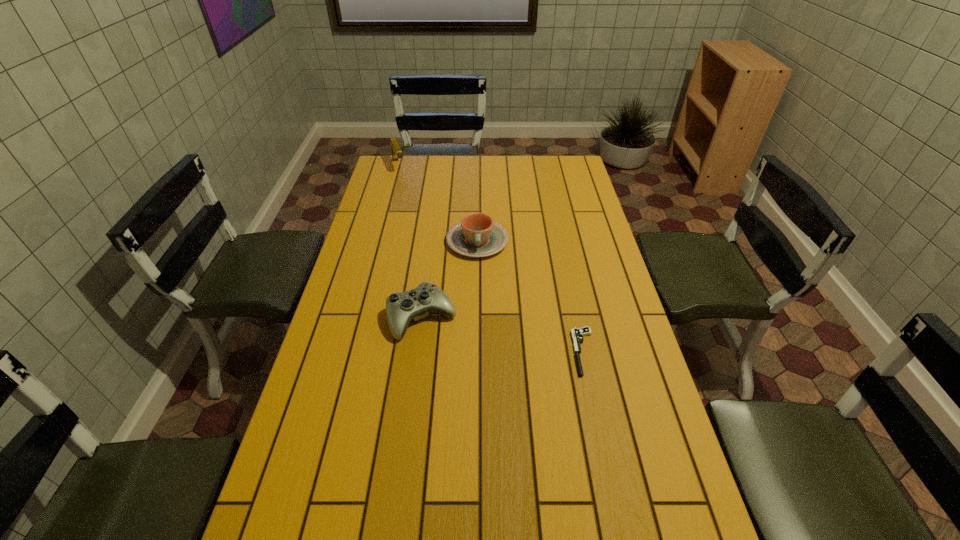
At what (x,y) coordinates should I click in order to perform the action: click on control. Please return your answer as a coordinate pair (x, y). The width and height of the screenshot is (960, 540). Looking at the image, I should click on (401, 308).

In order to click on the rightmost object in this screenshot , I will do `click(577, 334)`.

Find the location of a particular element. Image resolution: width=960 pixels, height=540 pixels. the shortest object is located at coordinates (577, 334).

The height and width of the screenshot is (540, 960). I want to click on the second farthest object, so click(x=476, y=235).

In order to click on the tallest object in this screenshot , I will do `click(396, 151)`.

Where is `the farther pistol`? the farther pistol is located at coordinates (396, 151).

Find the location of a particular element. vacant area situated on the front of the control is located at coordinates (416, 366).

Find the location of a particular element. The image size is (960, 540). free space located on the front-facing side of the rightmost object is located at coordinates (610, 471).

Where is `vacant space located on the handle side of the chinaware`? vacant space located on the handle side of the chinaware is located at coordinates (480, 333).

In order to click on free space located on the handle side of the chinaware in this screenshot , I will do `click(481, 349)`.